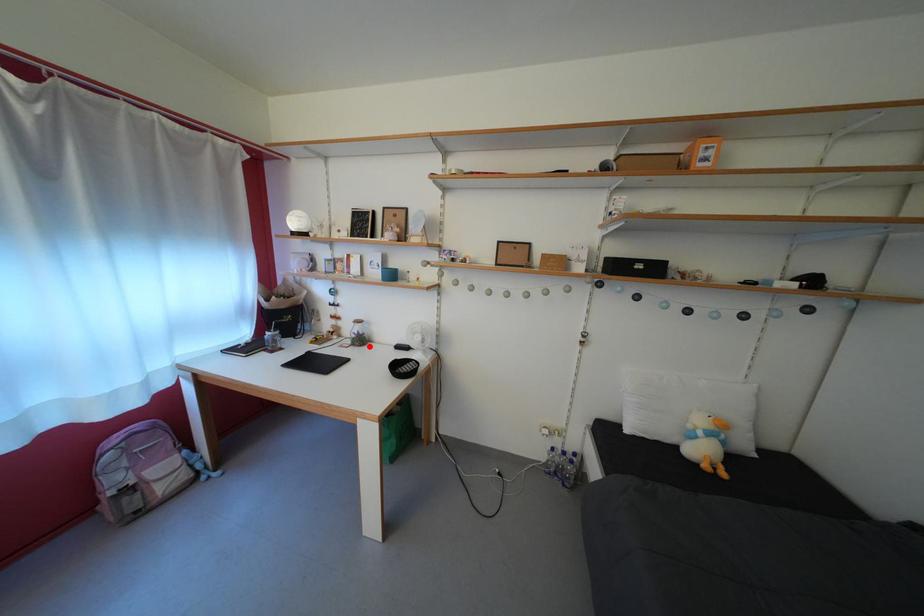
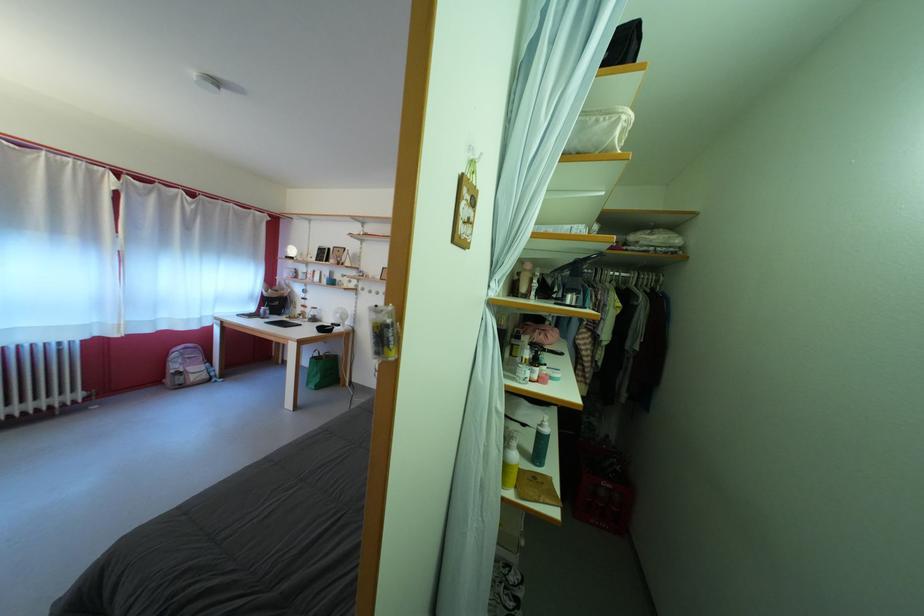
In the second image, find the point that corresponds to the highlighted location in the first image.

(322, 325)